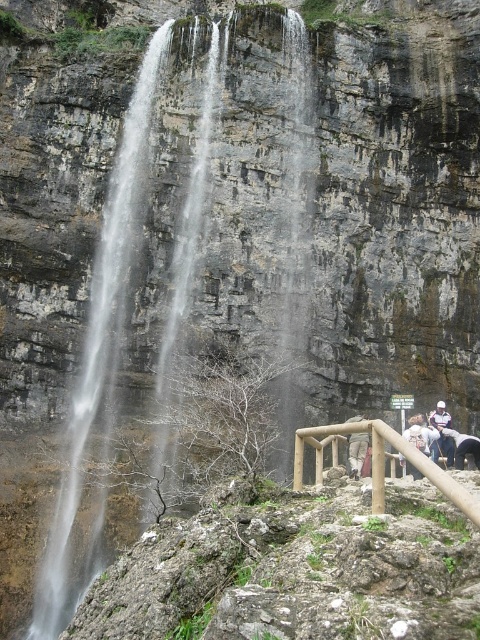
Question: Among these points, which one is nearest to the camera?

Choices:
 (A) (474, 451)
 (B) (433, 454)
 (C) (360, 451)

Answer: (A)

Question: Is white cotton jacket at lower right above light brown wooden post at lower right?

Choices:
 (A) no
 (B) yes

Answer: (A)

Question: Can you confirm if wooden railing at lower center is bigger than dark gray stone person at lower right?

Choices:
 (A) no
 (B) yes

Answer: (B)

Question: Which object appears closest to the camera in this image?

Choices:
 (A) clear water at center
 (B) white leather jacket at lower right
 (C) light brown wooden post at lower right

Answer: (C)

Question: Which point is farther to the camera?

Choices:
 (A) camouflage pants at center
 (B) wooden railing at lower center

Answer: (A)

Question: Is wooden railing at lower center bigger than white leather jacket at lower right?

Choices:
 (A) no
 (B) yes

Answer: (B)